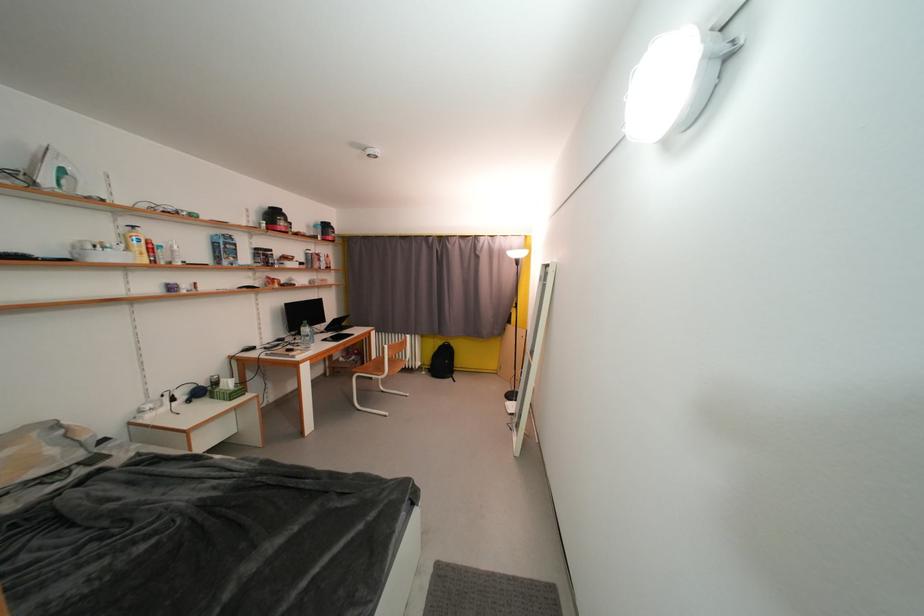
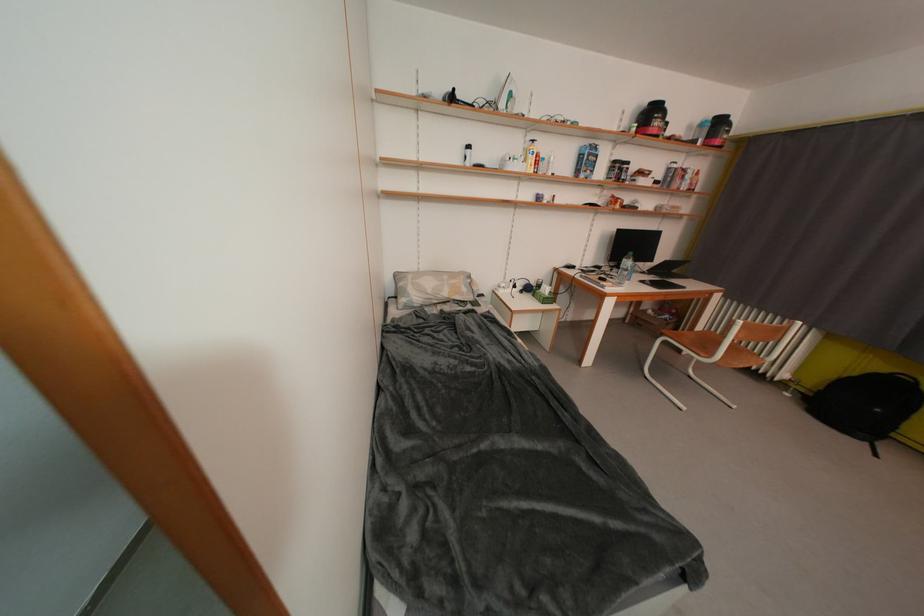
Where in the second image is the point corresponding to (x=310, y=331) from the first image?

(631, 262)